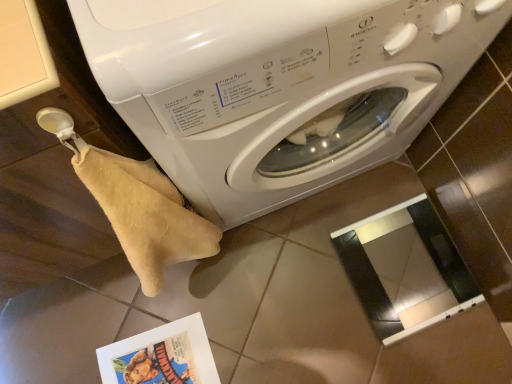
Locate an element on the screen. white glossy washing machine at center is located at coordinates (277, 85).

What do you see at coordinates (277, 85) in the screenshot? The height and width of the screenshot is (384, 512). I see `white glossy washing machine at center` at bounding box center [277, 85].

Image resolution: width=512 pixels, height=384 pixels. What do you see at coordinates (161, 356) in the screenshot?
I see `matte paper comic book at lower left` at bounding box center [161, 356].

Find the location of a particular element. The width and height of the screenshot is (512, 384). matte paper comic book at lower left is located at coordinates (161, 356).

Image resolution: width=512 pixels, height=384 pixels. Identify the location of white glossy washing machine at center. (277, 85).

Which is more to the right, white glossy washing machine at center or matte paper comic book at lower left?

white glossy washing machine at center is more to the right.

In the scene shown: Is the depth of white glossy washing machine at center less than that of matte paper comic book at lower left?

Yes.

Does point (398, 84) come behind point (165, 324)?

No.

From the image's perspective, would you say white glossy washing machine at center is shown under matte paper comic book at lower left?

No, from the image's perspective, white glossy washing machine at center is not below matte paper comic book at lower left.

From a real-world perspective, which is physically above, white glossy washing machine at center or matte paper comic book at lower left?

white glossy washing machine at center, from a real-world perspective.

Considering the sizes of white glossy washing machine at center and matte paper comic book at lower left in the image, is white glossy washing machine at center wider or thinner than matte paper comic book at lower left?

In the image, white glossy washing machine at center appears to be wider than matte paper comic book at lower left.

Is white glossy washing machine at center taller than matte paper comic book at lower left?

Yes, white glossy washing machine at center is taller than matte paper comic book at lower left.

Is white glossy washing machine at center bigger than matte paper comic book at lower left?

Yes, white glossy washing machine at center is bigger than matte paper comic book at lower left.

Is white glossy washing machine at center outside of matte paper comic book at lower left?

Yes.

Is white glossy washing machine at center positioned far away from matte paper comic book at lower left?

No, white glossy washing machine at center is not far away from matte paper comic book at lower left.

Could you tell me if white glossy washing machine at center is facing matte paper comic book at lower left?

No, white glossy washing machine at center is not facing towards matte paper comic book at lower left.

What's the angular difference between white glossy washing machine at center and matte paper comic book at lower left's facing directions?

5.05 degrees.

Where is `comic book below the white glossy washing machine at center (from the image's perspective)`? The image size is (512, 384). comic book below the white glossy washing machine at center (from the image's perspective) is located at coordinates (161, 356).

Is matte paper comic book at lower left at the left side of white glossy washing machine at center?

Correct, you'll find matte paper comic book at lower left to the left of white glossy washing machine at center.

Relative to white glossy washing machine at center, is matte paper comic book at lower left in front or behind?

Clearly, matte paper comic book at lower left is behind white glossy washing machine at center.

Which is less distant, [193,356] or [358,33]?

Point [193,356] is farther from the camera than point [358,33].

From the image's perspective, is matte paper comic book at lower left above or below white glossy washing machine at center?

Based on their image positions, matte paper comic book at lower left is located beneath white glossy washing machine at center.

From a real-world perspective, who is located lower, matte paper comic book at lower left or white glossy washing machine at center?

From a 3D spatial view, matte paper comic book at lower left is below.

Is matte paper comic book at lower left thinner than white glossy washing machine at center?

Correct, the width of matte paper comic book at lower left is less than that of white glossy washing machine at center.

Which of these two, matte paper comic book at lower left or white glossy washing machine at center, stands taller?

white glossy washing machine at center.

Is matte paper comic book at lower left smaller than white glossy washing machine at center?

Yes.

Would you say white glossy washing machine at center is part of matte paper comic book at lower left's contents?

No.

Based on the photo, would you consider matte paper comic book at lower left to be distant from white glossy washing machine at center?

No.

Could you tell me if matte paper comic book at lower left is facing white glossy washing machine at center?

No, matte paper comic book at lower left is not aimed at white glossy washing machine at center.

Where is `washing machine above the matte paper comic book at lower left (from the image's perspective)`? Image resolution: width=512 pixels, height=384 pixels. washing machine above the matte paper comic book at lower left (from the image's perspective) is located at coordinates (277, 85).

Locate an element on the screen. washing machine above the matte paper comic book at lower left (from a real-world perspective) is located at coordinates pyautogui.click(x=277, y=85).

The width and height of the screenshot is (512, 384). In order to click on washing machine that is above the matte paper comic book at lower left (from the image's perspective) in this screenshot , I will do `click(277, 85)`.